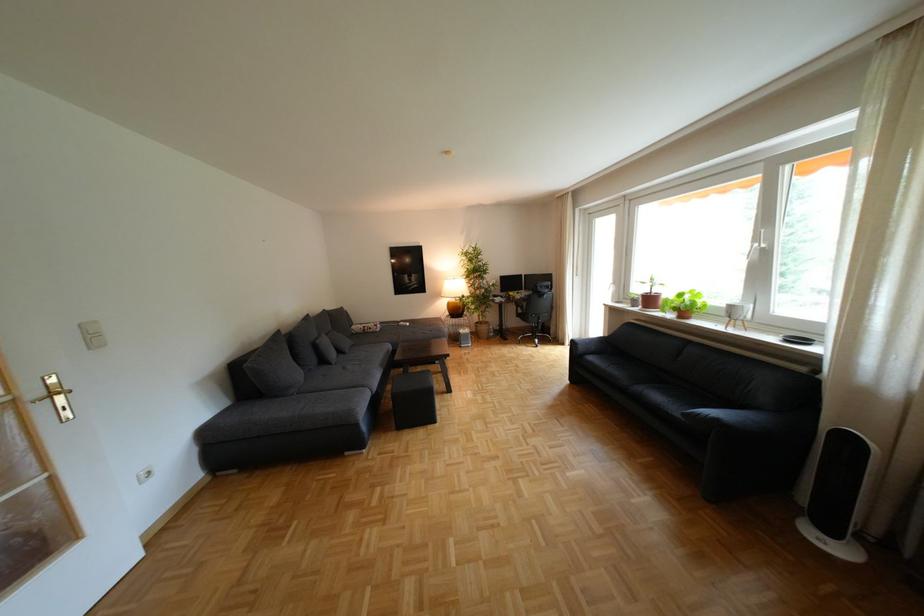
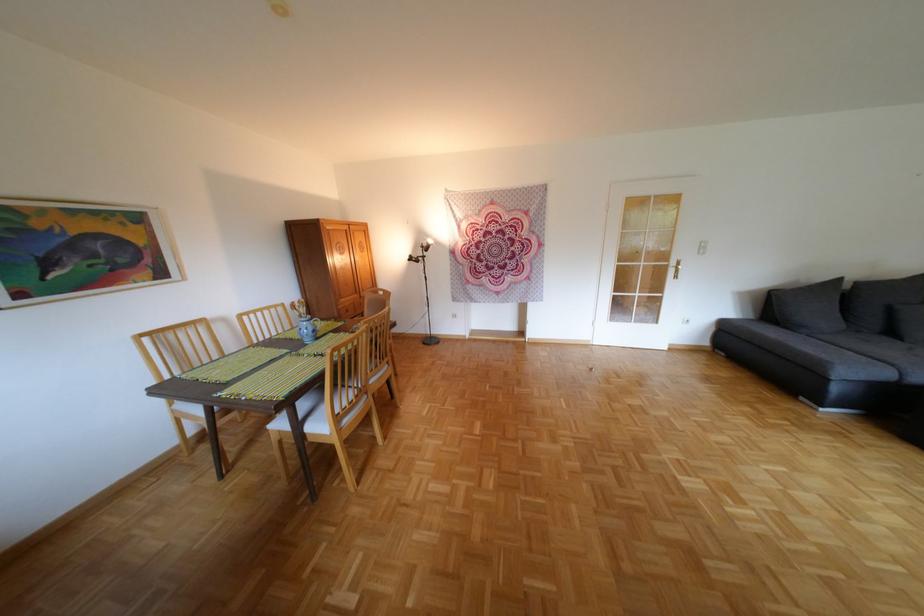
In the second image, find the point that corresponds to the point at 375,387 in the first image.

(906, 365)